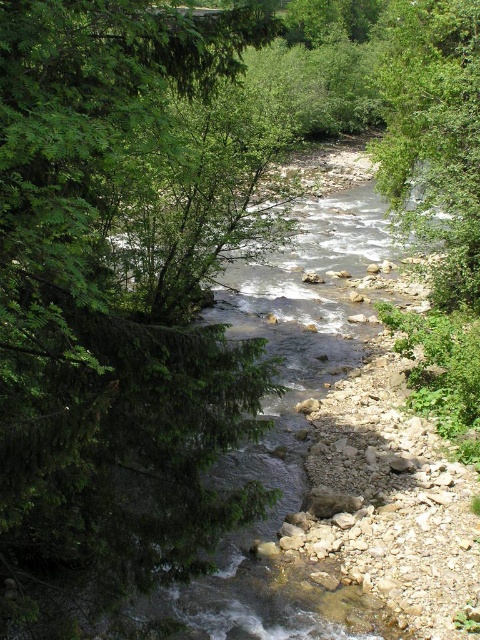
Based on the photo, does green leafy tree at left have a lesser width compared to green leafy tree at right?

Yes, green leafy tree at left is thinner than green leafy tree at right.

Locate an element on the screen. The image size is (480, 640). green leafy tree at left is located at coordinates (121, 296).